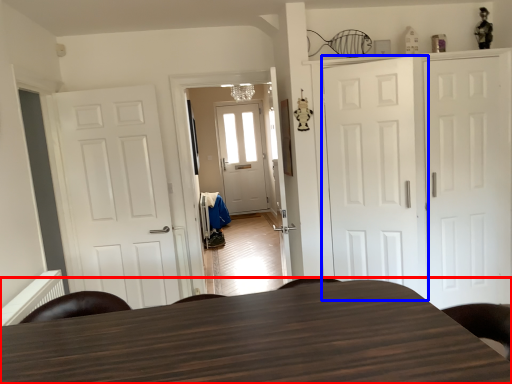
Question: Which object appears farthest to the camera in this image, table (highlighted by a red box) or door (highlighted by a blue box)?

Choices:
 (A) table
 (B) door

Answer: (B)